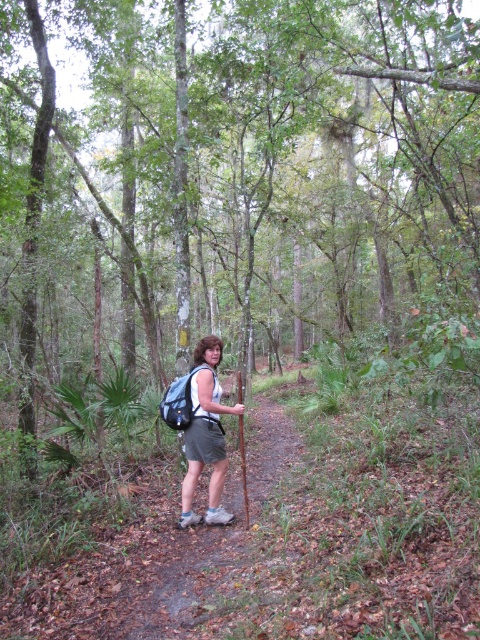
Does point (287, 456) come behind point (222, 432)?

That is True.

Does gray fabric backpack at center have a lesser height compared to matte gray backpack at center?

Yes.

Find the location of a particular element. This screenshot has height=640, width=480. gray fabric backpack at center is located at coordinates (180, 572).

Measure the distance from matte gray shorts at center to matte gray backpack at center.

matte gray shorts at center is 10.78 inches away from matte gray backpack at center.

Who is more distant from viewer, (204,449) or (168,419)?

The point (204,449) is behind.

At what (x,y) coordinates should I click in order to perform the action: click on matte gray shorts at center. Please return your answer as a coordinate pair (x, y). The image size is (480, 640). Looking at the image, I should click on (205, 435).

Is gray fabric backpack at center shorter than matte gray shorts at center?

Indeed, gray fabric backpack at center has a lesser height compared to matte gray shorts at center.

Consider the image. Can you confirm if gray fabric backpack at center is smaller than matte gray shorts at center?

No, gray fabric backpack at center is not smaller than matte gray shorts at center.

This screenshot has height=640, width=480. Identify the location of gray fabric backpack at center. (180, 572).

Where is `gray fabric backpack at center`? The width and height of the screenshot is (480, 640). gray fabric backpack at center is located at coordinates [180, 572].